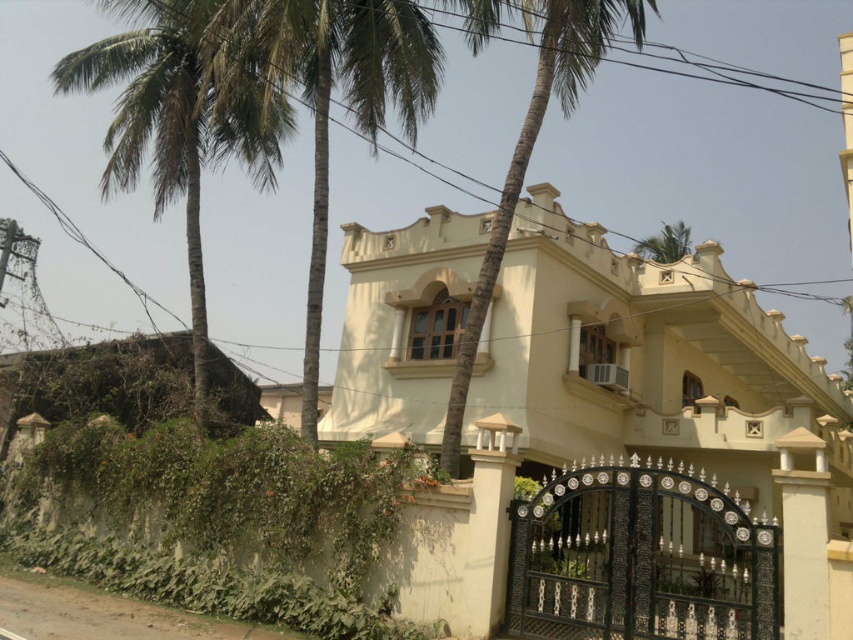
Question: Does green leafy palm tree at left have a greater width compared to green leafy palm tree at upper left?

Choices:
 (A) yes
 (B) no

Answer: (A)

Question: Is green leafy palm tree at left behind green leafy palm tree at upper left?

Choices:
 (A) no
 (B) yes

Answer: (B)

Question: Observing the image, what is the correct spatial positioning of green leafy palm tree at left in reference to green leafy palm tree at upper left?

Choices:
 (A) left
 (B) right

Answer: (A)

Question: Which of these objects is positioned closest to the green leafy palm tree at center?

Choices:
 (A) green leafy palm tree at upper left
 (B) green leafy palm tree at left

Answer: (A)

Question: Which of these objects is positioned farthest from the green leafy palm tree at upper left?

Choices:
 (A) green leafy palm tree at left
 (B) green leafy palm tree at center

Answer: (B)

Question: Which object is closer to the camera taking this photo?

Choices:
 (A) green leafy palm tree at center
 (B) green leafy palm tree at upper left

Answer: (A)